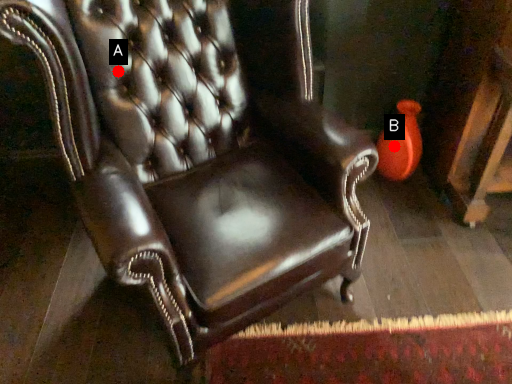
Question: Two points are circled on the image, labeled by A and B beside each circle. Among these points, which one is farthest from the camera?

Choices:
 (A) A is further
 (B) B is further

Answer: (B)